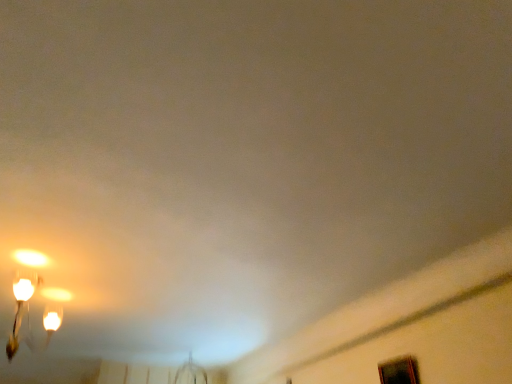
Describe the element at coordinates (24, 297) in the screenshot. The image size is (512, 384). I see `matte glass chandelier at upper left` at that location.

Locate an element on the screen. This screenshot has width=512, height=384. matte glass chandelier at upper left is located at coordinates (24, 297).

I want to click on matte glass chandelier at upper left, so click(x=24, y=297).